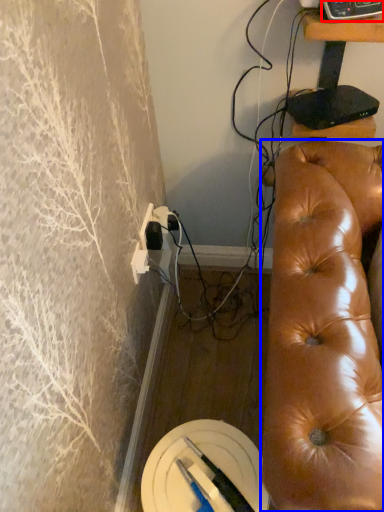
Question: Which object is closer to the camera taking this photo, equipment (highlighted by a red box) or studio couch (highlighted by a blue box)?

Choices:
 (A) equipment
 (B) studio couch

Answer: (B)